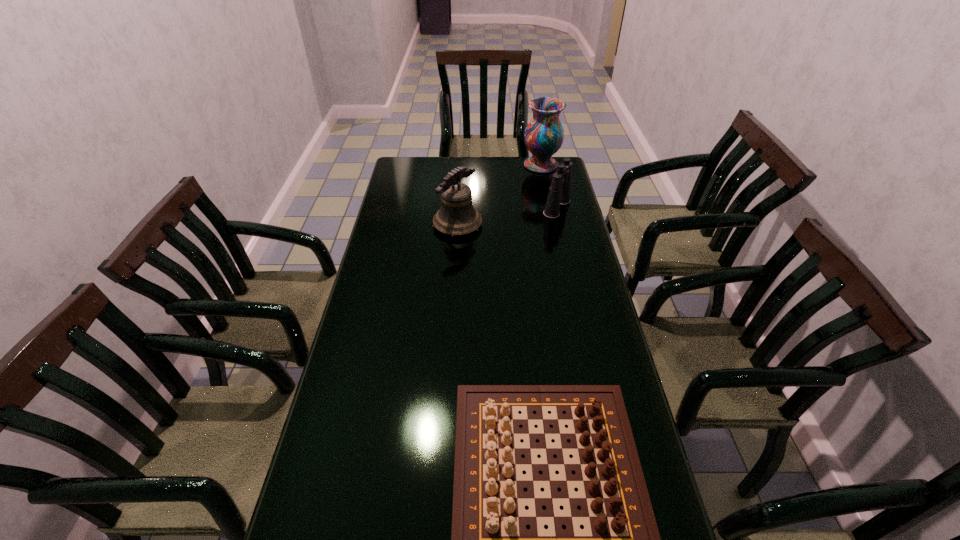
Where is `object at the far right corner`? object at the far right corner is located at coordinates (544, 134).

Locate an element on the screen. The width and height of the screenshot is (960, 540). vacant space at the left edge is located at coordinates (395, 270).

The height and width of the screenshot is (540, 960). What are the coordinates of `vacant position at the right edge of the desktop` in the screenshot? It's located at (572, 209).

Locate an element on the screen. The width and height of the screenshot is (960, 540). unoccupied position between the binoculars and the vase is located at coordinates (549, 187).

This screenshot has width=960, height=540. What are the coordinates of `vacant area between the vase and the bell` in the screenshot? It's located at (499, 195).

Where is `free space between the farthest object and the bell`? The image size is (960, 540). free space between the farthest object and the bell is located at coordinates (499, 195).

This screenshot has height=540, width=960. I want to click on free point between the bell and the tallest object, so click(499, 195).

Identify the location of vacant space that is in between the binoculars and the vase. The image size is (960, 540). (549, 187).

Choose which object is the second nearest neighbor to the tallest object. Please provide its 2D coordinates. Your answer should be formatted as a tuple, i.e. [(x, y)], where the tuple contains the x and y coordinates of a point satisfying the conditions above.

[(457, 216)]

Where is `object that is the closest to the bell`? object that is the closest to the bell is located at coordinates (559, 192).